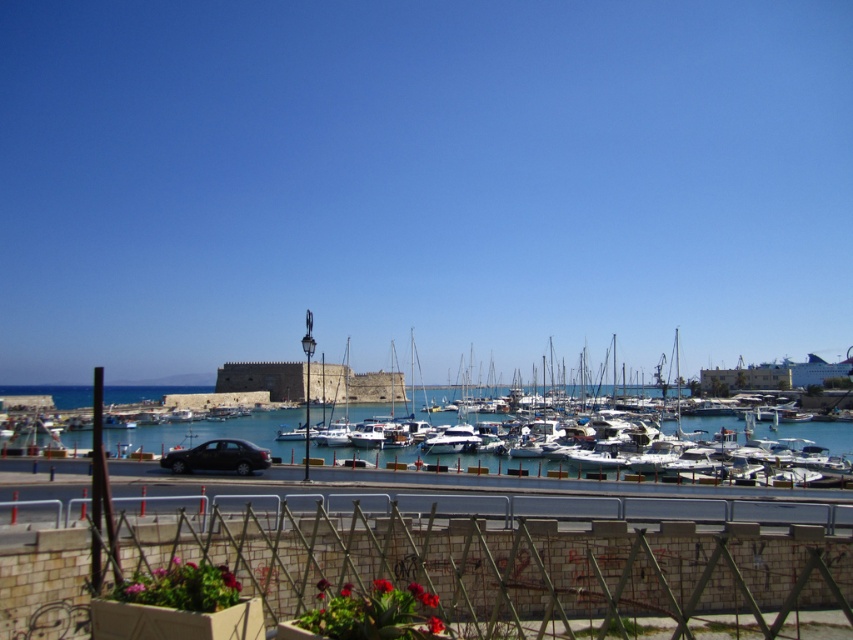
Question: Observing the image, what is the correct spatial positioning of blue water at center in reference to white glossy boat at center?

Choices:
 (A) above
 (B) below

Answer: (B)

Question: Which object appears farthest from the camera in this image?

Choices:
 (A) shiny black sedan at center
 (B) brick wall at lower center

Answer: (A)

Question: Which object is the farthest from the shiny black sedan at center?

Choices:
 (A) white glossy boat at center
 (B) blue water at center
 (C) brick wall at lower center

Answer: (A)

Question: Which of the following is the farthest from the observer?

Choices:
 (A) (380, 454)
 (B) (218, 461)

Answer: (A)

Question: Can you confirm if blue water at center is wider than white glossy boat at center?

Choices:
 (A) no
 (B) yes

Answer: (B)

Question: Does brick wall at lower center appear under white glossy boat at center?

Choices:
 (A) yes
 (B) no

Answer: (B)